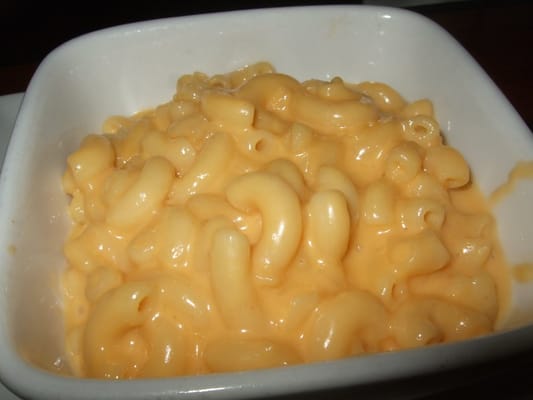
You are a GUI agent. You are given a task and a screenshot of the screen. Output one action in this format:
    pyautogui.click(x=<x>, y=<y>)
    Task: Click on the bowl
    Image resolution: width=533 pixels, height=400 pixels.
    Given the screenshot: What is the action you would take?
    click(458, 101)